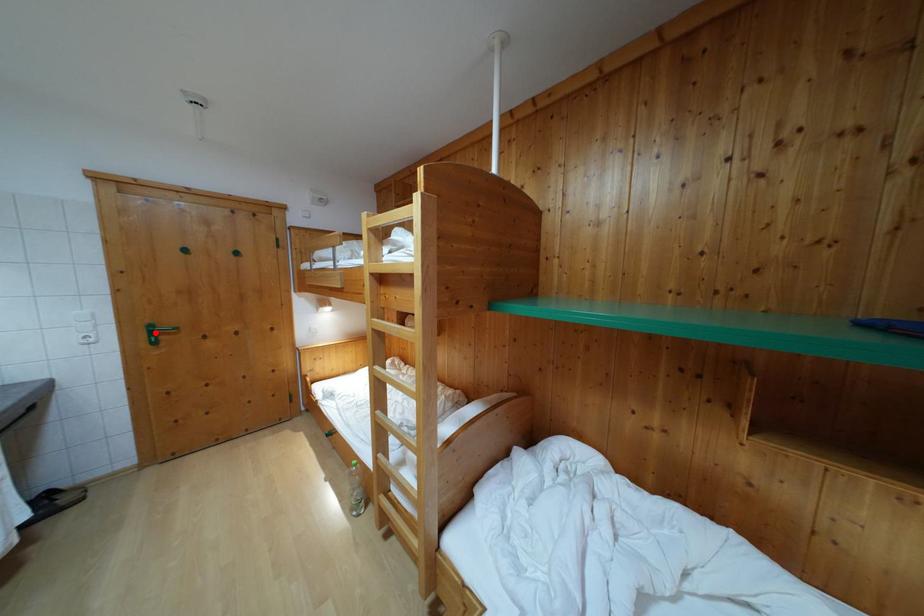
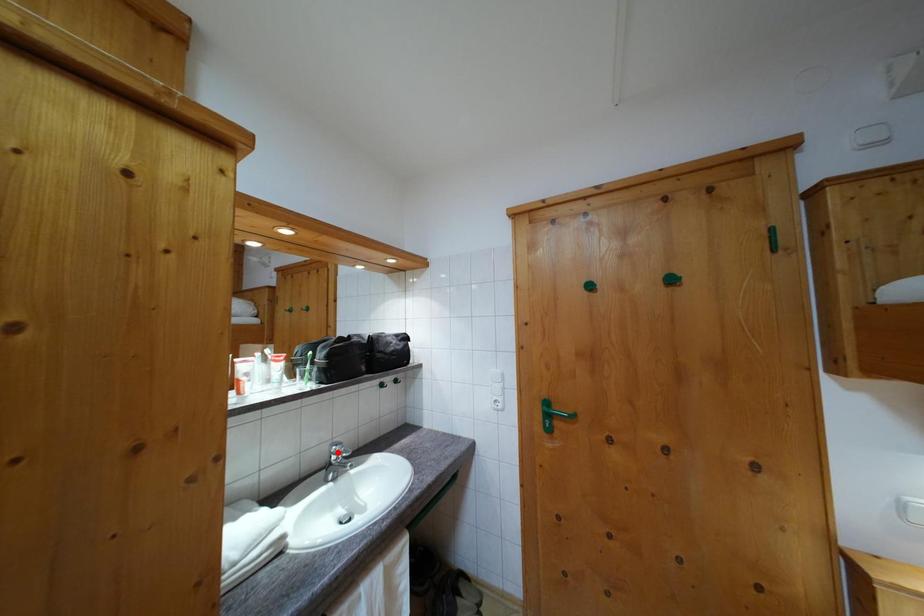
I am providing you with two images of the same scene from different viewpoints. A red point is marked on the first image and another point is marked on the second image. Is the marked point in image1 the same physical position as the marked point in image2?

No